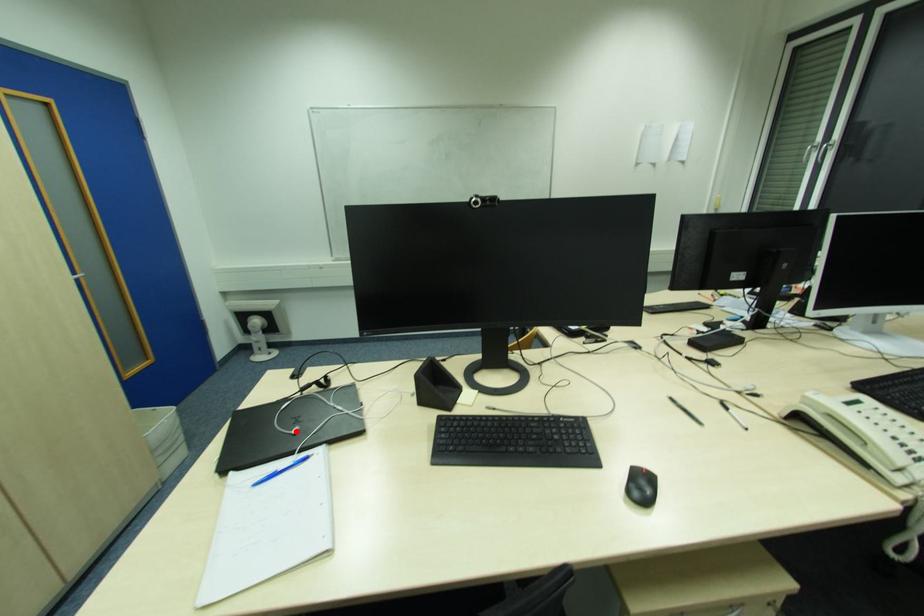
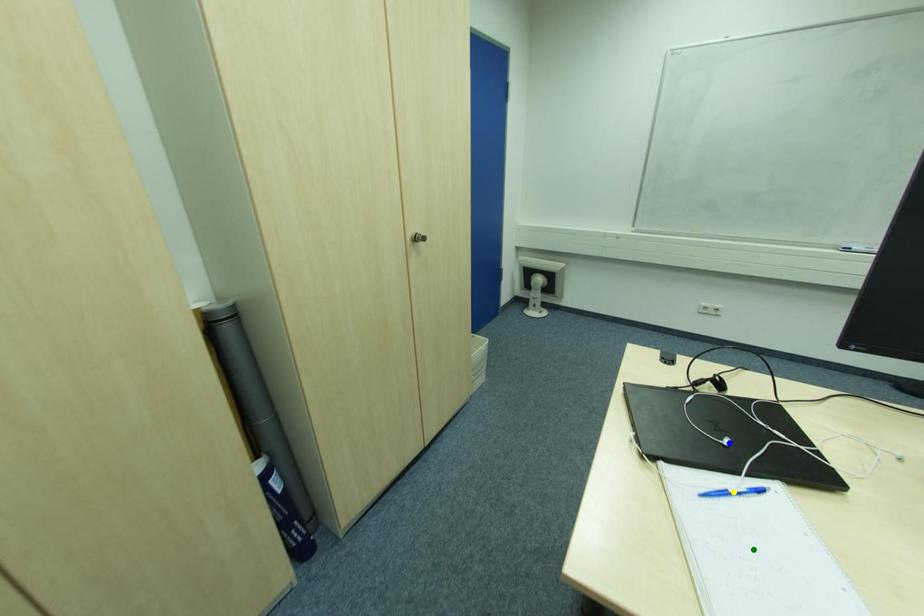
Question: I am providing you with two images of the same scene from different viewpoints. A red point is marked on the first image. You are given multiple points on the second image. Which mark in image 2 goes with the point in image 1?

Choices:
 (A) yellow point
 (B) blue point
 (C) green point

Answer: (B)